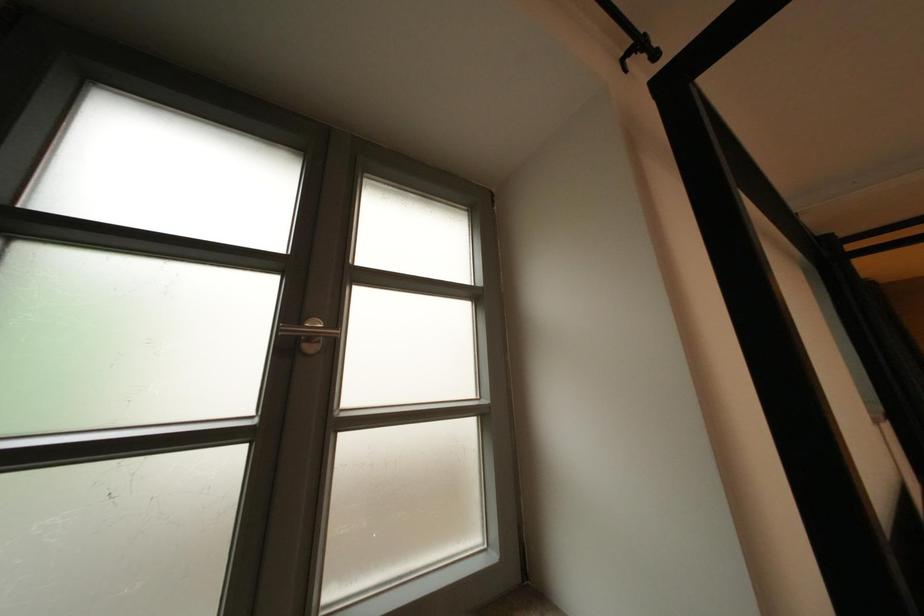
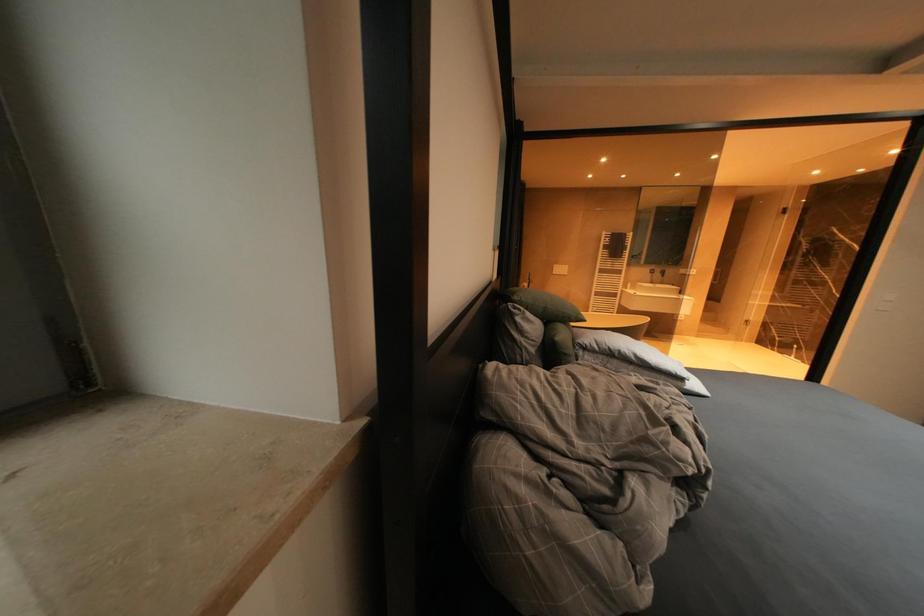
How did the camera likely rotate?

The rotation direction of the camera is right-down.